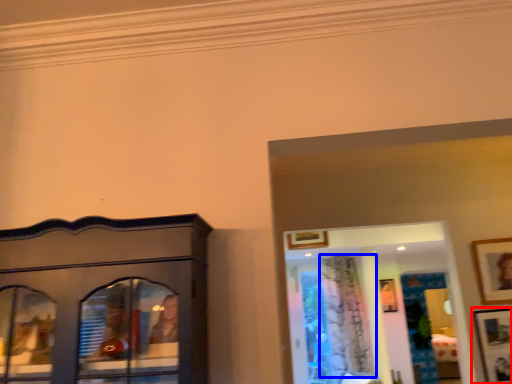
Question: Among these objects, which one is farthest to the camera, picture frame (highlighted by a red box) or curtain (highlighted by a blue box)?

Choices:
 (A) picture frame
 (B) curtain

Answer: (B)